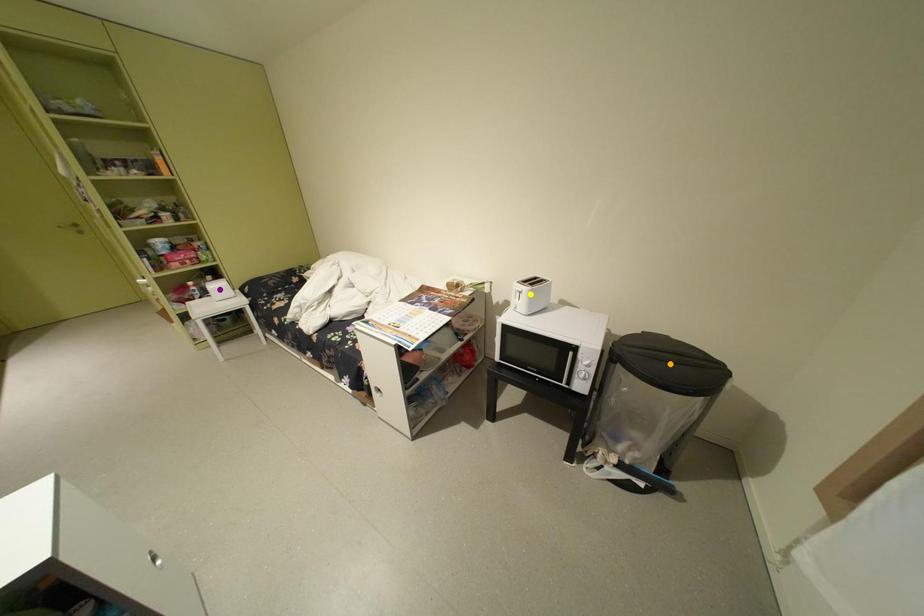
Order these from nearest to farthest:
A) yellow point
B) purple point
C) orange point

1. orange point
2. yellow point
3. purple point